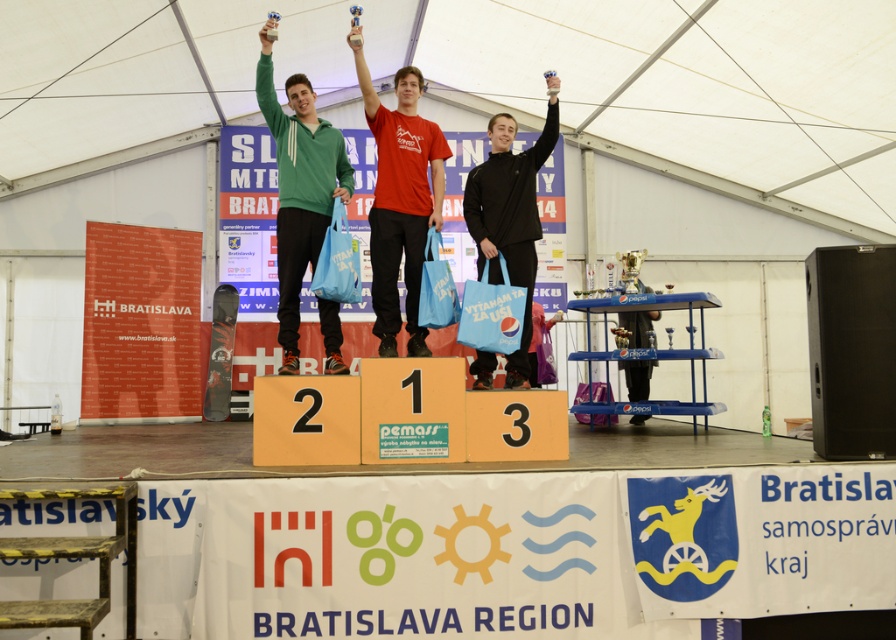
You are an event organizer and need to place a decorative ribbon on the podium. The ribbon must be placed above the black matte jacket at center but below the blue plastic shelf at center. Is this possible given their sizes?

The black matte jacket at center has a smaller size compared to the blue plastic shelf at center. Since the jacket is smaller, it can be placed below the shelf, allowing the ribbon to be positioned between them.

You are a photographer at the podium ceremony. You need to capture a photo of the black matte jacket at center and the blue plastic shelf at center. Which object is positioned to the left of the other?

The black matte jacket at center is to the left of the blue plastic shelf at center.